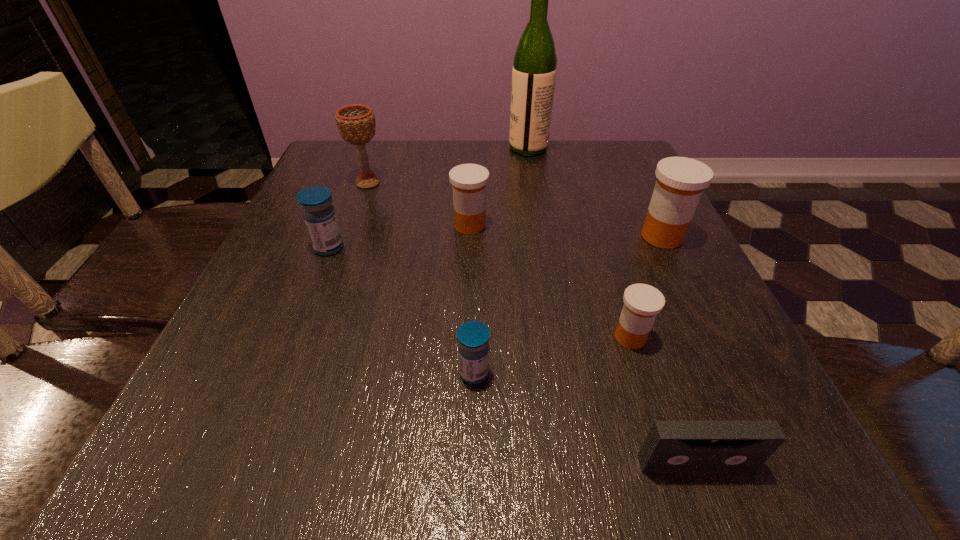
At what (x,y) coordinates should I click in order to perform the action: click on the nearest orange medicine. Please return your answer as a coordinate pair (x, y). Image resolution: width=960 pixels, height=540 pixels. Looking at the image, I should click on (642, 302).

Locate an element on the screen. This screenshot has height=540, width=960. the nearer blue medicine is located at coordinates (473, 337).

At what (x,y) coordinates should I click in order to perform the action: click on the smaller blue medicine. Please return your answer as a coordinate pair (x, y). Looking at the image, I should click on (473, 337).

Where is `videotape`? This screenshot has width=960, height=540. videotape is located at coordinates (671, 446).

In order to click on free point located 0.390m on the label of the tallest object in this screenshot , I will do `click(360, 148)`.

At what (x,y) coordinates should I click in order to perform the action: click on vacant space positioned 0.240m on the label of the tallest object. Please return your answer as a coordinate pair (x, y). The height and width of the screenshot is (540, 960). Looking at the image, I should click on (418, 148).

This screenshot has width=960, height=540. I want to click on free space located 0.080m on the label of the tallest object, so click(479, 148).

What are the coordinates of `free location located on the right of the chalice` in the screenshot? It's located at (522, 183).

You are a GUI agent. You are given a task and a screenshot of the screen. Output one action in this format:
    pyautogui.click(x=<x>, y=<y>)
    Task: Click on the vacant space situated 0.210m on the label of the tallest medicine
    The width and height of the screenshot is (960, 540).
    Given the screenshot: What is the action you would take?
    pyautogui.click(x=534, y=237)

Identify the location of vacant area situated on the label of the tallest medicine. (554, 237).